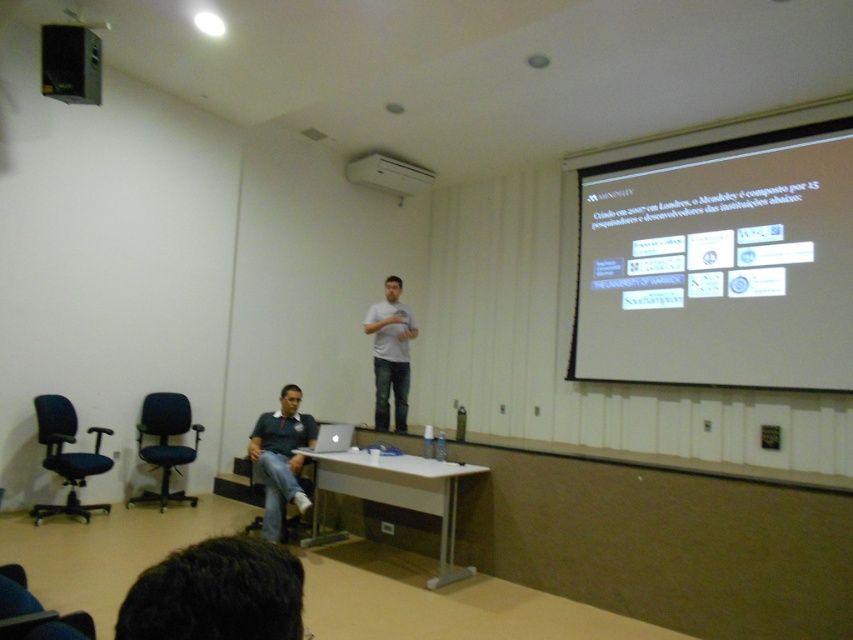
Question: Which object appears closest to the camera in this image?

Choices:
 (A) white plastic projector at upper center
 (B) black mesh office chair at left

Answer: (B)

Question: Which point is farther from the camera taking this photo?

Choices:
 (A) (65, 410)
 (B) (347, 163)
 (C) (346, 435)
 (D) (635, 310)

Answer: (B)

Question: Is black mesh office chair at left positioned behind silver metallic laptop at lower center?

Choices:
 (A) yes
 (B) no

Answer: (B)

Question: Is dark brown hair at lower center thinner than white matte shirt at center?

Choices:
 (A) no
 (B) yes

Answer: (B)

Question: Which point is closer to the camera?

Choices:
 (A) (239, 625)
 (B) (160, 502)

Answer: (A)

Question: Is green fabric shirt at lower left bigger than silver metallic laptop at lower center?

Choices:
 (A) yes
 (B) no

Answer: (A)